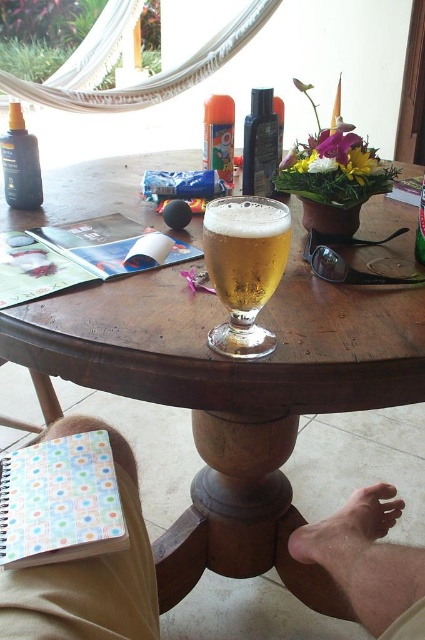
Question: Considering the relative positions of wooden table at center and translucent plastic bottle at center in the image provided, where is wooden table at center located with respect to translucent plastic bottle at center?

Choices:
 (A) above
 (B) below

Answer: (B)

Question: Considering the real-world distances, which object is closest to the skinny tan leg at lower center?

Choices:
 (A) matte black lotion at upper left
 (B) pale skin foot at lower center
 (C) golden glass beer at center

Answer: (B)

Question: Where is golden glass beer at center located in relation to matte black lotion at upper left in the image?

Choices:
 (A) right
 (B) left

Answer: (A)

Question: Which object is positioned farthest from the pale skin foot at lower center?

Choices:
 (A) translucent plastic bottle at center
 (B) skinny tan leg at lower center
 (C) black plastic bottle at center
 (D) matte black lotion at upper left

Answer: (D)

Question: Is skinny tan leg at lower center smaller than matte black lotion at upper left?

Choices:
 (A) no
 (B) yes

Answer: (A)

Question: Which point is farther to the camera?

Choices:
 (A) (232, 432)
 (B) (215, 129)
 (C) (31, 184)
 (D) (269, 294)

Answer: (B)